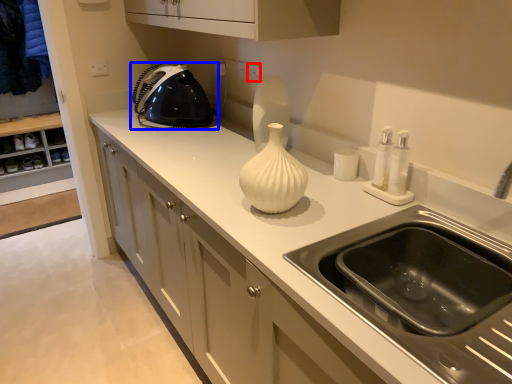
Question: Which of the following is the closest to the observer, electric outlet (highlighted by a red box) or home appliance (highlighted by a blue box)?

Choices:
 (A) electric outlet
 (B) home appliance

Answer: (B)